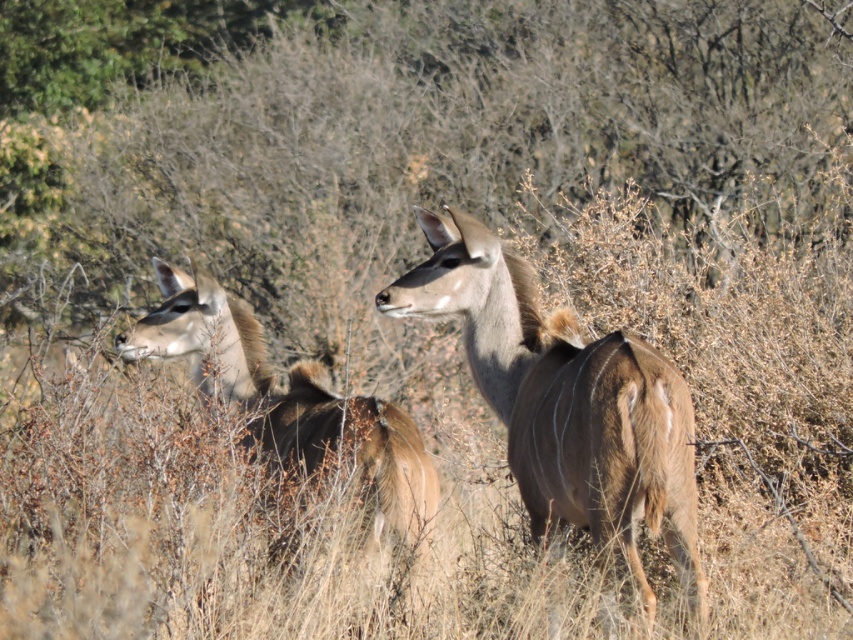
Question: Does brown furry deer at center appear under brown furry deer at left?

Choices:
 (A) no
 (B) yes

Answer: (B)

Question: Can you confirm if brown furry deer at center is positioned below brown furry deer at left?

Choices:
 (A) yes
 (B) no

Answer: (A)

Question: Among these points, which one is farthest from the camera?

Choices:
 (A) (611, 416)
 (B) (399, 451)

Answer: (B)

Question: Is brown furry deer at center smaller than brown furry deer at left?

Choices:
 (A) no
 (B) yes

Answer: (B)

Question: Which object is farther from the camera taking this photo?

Choices:
 (A) brown furry deer at left
 (B) brown furry deer at center

Answer: (A)

Question: Which point is farther to the camera?

Choices:
 (A) brown furry deer at center
 (B) brown furry deer at left

Answer: (B)